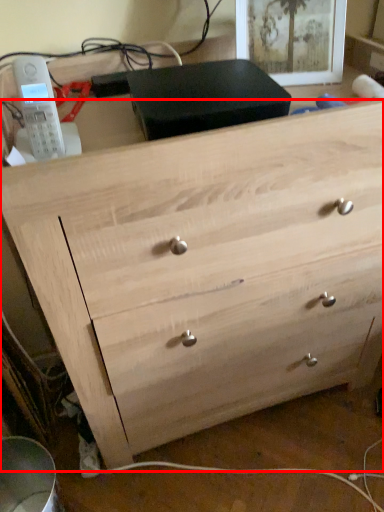
Question: From the image, what is the correct spatial relationship of chest of drawers (annotated by the red box) in relation to picture frame?

Choices:
 (A) left
 (B) right

Answer: (A)